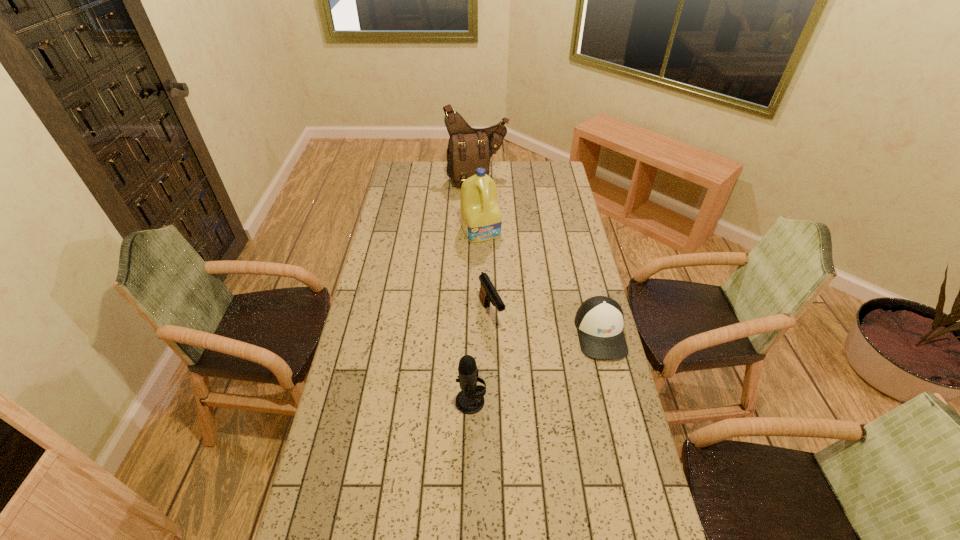
Identify the location of empty space that is in between the fourth nearest object and the second shortest object. This screenshot has height=540, width=960. click(486, 273).

Locate an element on the screen. vacant point located between the fourth nearest object and the shortest object is located at coordinates point(540,282).

Locate an element on the screen. This screenshot has height=540, width=960. vacant area that lies between the second tallest object and the shortest object is located at coordinates click(540, 282).

Choose which object is the third nearest neighbor to the detergent. Please provide its 2D coordinates. Your answer should be formatted as a tuple, i.e. [(x, y)], where the tuple contains the x and y coordinates of a point satisfying the conditions above.

[(599, 320)]

Locate an element on the screen. object that stands as the third closest to the farthest object is located at coordinates (599, 320).

You are a GUI agent. You are given a task and a screenshot of the screen. Output one action in this format:
    pyautogui.click(x=<x>, y=<y>)
    Task: Click on the vacant space that satisfies the following two spatial constraints: 1. on the front side of the second shortest object; 2. on the right side of the shoulder bag
    This screenshot has width=960, height=540.
    Given the screenshot: What is the action you would take?
    pyautogui.click(x=476, y=314)

In order to click on free space in the image that satisfies the following two spatial constraints: 1. on the front side of the farthest object; 2. on the left side of the fourth nearest object in this screenshot , I will do `click(477, 231)`.